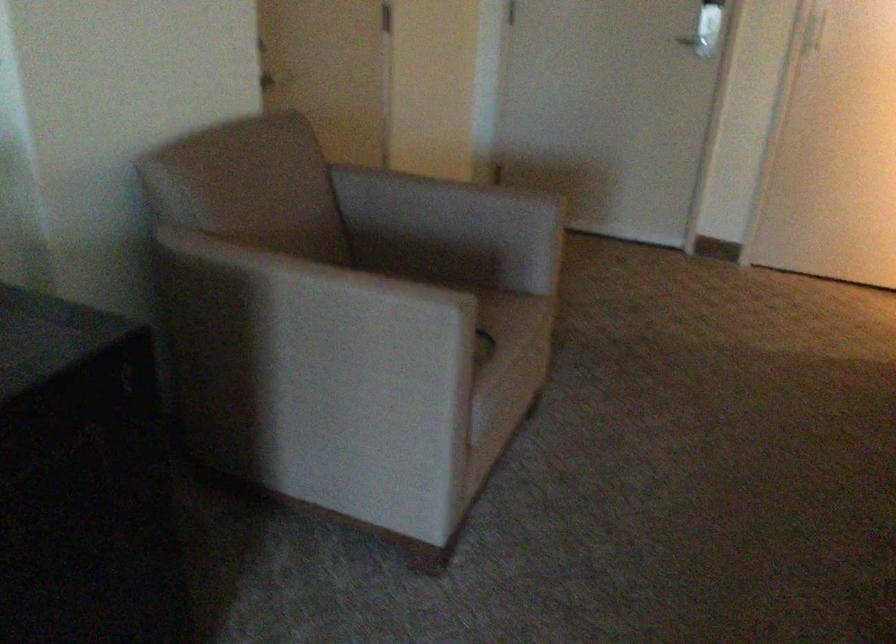
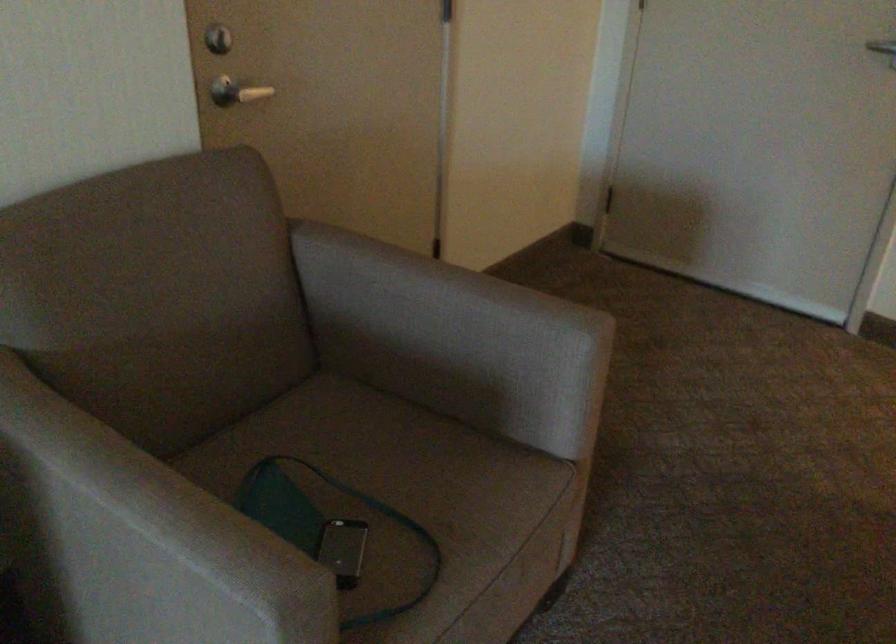
Locate, in the second image, the point that corresponds to point 357,295 in the first image.

(150, 538)